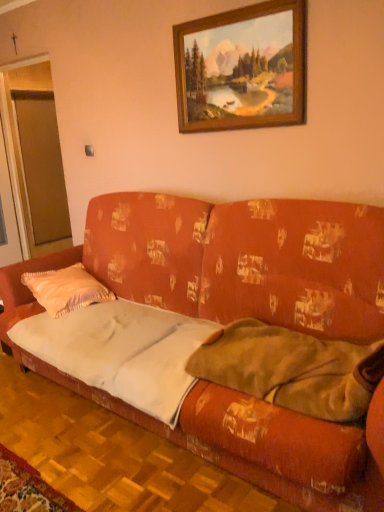
Locate an element on the screen. soft green blanket at right is located at coordinates (292, 369).

Find the location of a particular element. This screenshot has height=512, width=384. satin peach pillow at left is located at coordinates (66, 289).

The width and height of the screenshot is (384, 512). What do you see at coordinates (239, 318) in the screenshot? I see `velvet orange couch at center` at bounding box center [239, 318].

Locate an element on the screen. The width and height of the screenshot is (384, 512). transparent glass door at left is located at coordinates (41, 167).

Is soft green blanket at right aimed at velvet orange couch at center?

Yes, soft green blanket at right is turned towards velvet orange couch at center.

Considering the relative sizes of soft green blanket at right and velvet orange couch at center in the image provided, is soft green blanket at right taller than velvet orange couch at center?

In fact, soft green blanket at right may be shorter than velvet orange couch at center.

From the image's perspective, is soft green blanket at right below velvet orange couch at center?

Yes, from the image's perspective, soft green blanket at right is below velvet orange couch at center.

Considering the positions of points (339, 408) and (231, 458), is point (339, 408) closer to camera compared to point (231, 458)?

Yes, it is in front of point (231, 458).

Is white fabric sheet at center thinner than wooden picture frame at upper center?

No, white fabric sheet at center is not thinner than wooden picture frame at upper center.

Between white fabric sheet at center and wooden picture frame at upper center, which one has more height?

Standing taller between the two is wooden picture frame at upper center.

Is white fabric sheet at center not within wooden picture frame at upper center?

white fabric sheet at center lies outside wooden picture frame at upper center's area.

Between transparent glass door at left and wooden picture frame at upper center, which one appears on the left side from the viewer's perspective?

Answer: transparent glass door at left.

Can you confirm if transparent glass door at left is wider than wooden picture frame at upper center?

Indeed, transparent glass door at left has a greater width compared to wooden picture frame at upper center.

Is transparent glass door at left located outside wooden picture frame at upper center?

Yes, transparent glass door at left is outside of wooden picture frame at upper center.

Is transparent glass door at left positioned with its back to wooden picture frame at upper center?

transparent glass door at left is not turned away from wooden picture frame at upper center.

Based on the photo, considering the positions of objects white fabric sheet at center and transparent glass door at left in the image provided, who is more to the right, white fabric sheet at center or transparent glass door at left?

white fabric sheet at center.

From the image's perspective, is white fabric sheet at center beneath transparent glass door at left?

Correct, white fabric sheet at center appears lower than transparent glass door at left in the image.

Between point (87, 329) and point (43, 147), which one is positioned in front?

The point (87, 329) is closer.

What's the angular difference between velvet orange couch at center and white fabric sheet at center's facing directions?

The angular difference between velvet orange couch at center and white fabric sheet at center is 1.5 degrees.

Is velvet orange couch at center far from white fabric sheet at center?

velvet orange couch at center is actually quite close to white fabric sheet at center.

You are a GUI agent. You are given a task and a screenshot of the screen. Output one action in this format:
    pyautogui.click(x=<x>, y=<y>)
    Task: Click on the studio couch that appears above the white fabric sheet at center (from the image's perspective)
    This screenshot has height=512, width=384.
    Given the screenshot: What is the action you would take?
    pyautogui.click(x=239, y=318)

Which object is further away from the camera, velvet orange couch at center or white fabric sheet at center?

white fabric sheet at center is further away from the camera.

From the image's perspective, is wooden picture frame at upper center above velvet orange couch at center?

Yes.

In order to click on picture frame located above the velvet orange couch at center (from a real-world perspective) in this screenshot , I will do `click(241, 68)`.

Considering the relative sizes of wooden picture frame at upper center and velvet orange couch at center in the image provided, is wooden picture frame at upper center bigger than velvet orange couch at center?

Incorrect, wooden picture frame at upper center is not larger than velvet orange couch at center.

Based on their positions, is wooden picture frame at upper center located to the left or right of velvet orange couch at center?

In the image, wooden picture frame at upper center appears on the right side of velvet orange couch at center.

Is the position of transparent glass door at left less distant than that of soft green blanket at right?

No.

From a real-world perspective, is transparent glass door at left on soft green blanket at right?

Correct, in the physical world, transparent glass door at left is higher than soft green blanket at right.

Between transparent glass door at left and soft green blanket at right, which one has smaller width?

transparent glass door at left is thinner.

Which is in front, point (53, 187) or point (343, 377)?

The point (343, 377) is in front.

You are a GUI agent. You are given a task and a screenshot of the screen. Output one action in this format:
    pyautogui.click(x=<x>, y=<y>)
    Task: Click on the blanket above the velvet orange couch at center (from a real-world perspective)
    This screenshot has height=512, width=384.
    Given the screenshot: What is the action you would take?
    pyautogui.click(x=292, y=369)

Image resolution: width=384 pixels, height=512 pixels. I want to click on picture frame to the right of white fabric sheet at center, so point(241,68).

Considering their positions, is wooden picture frame at upper center positioned closer to velvet orange couch at center than satin peach pillow at left?

The object closer to velvet orange couch at center is satin peach pillow at left.

Considering their positions, is transparent glass door at left positioned further to soft green blanket at right than satin peach pillow at left?

transparent glass door at left lies further to soft green blanket at right than the other object.

Looking at the image, which one is located further to white fabric sheet at center, transparent glass door at left or satin peach pillow at left?

transparent glass door at left is positioned further to the anchor white fabric sheet at center.

When comparing their distances from white fabric sheet at center, does wooden picture frame at upper center or velvet orange couch at center seem further?

wooden picture frame at upper center is positioned further to the anchor white fabric sheet at center.

From the picture: From the image, which object appears to be farther from white fabric sheet at center, transparent glass door at left or wooden picture frame at upper center?

Based on the image, transparent glass door at left appears to be further to white fabric sheet at center.

Estimate the real-world distances between objects in this image. Which object is further from white fabric sheet at center, velvet orange couch at center or soft green blanket at right?

Based on the image, soft green blanket at right appears to be further to white fabric sheet at center.

Looking at the image, which one is located closer to soft green blanket at right, wooden picture frame at upper center or satin peach pillow at left?

Among the two, satin peach pillow at left is located nearer to soft green blanket at right.

Which object lies nearer to the anchor point transparent glass door at left, satin peach pillow at left or wooden picture frame at upper center?

The object closer to transparent glass door at left is satin peach pillow at left.

The height and width of the screenshot is (512, 384). In order to click on blanket between wooden picture frame at upper center and white fabric sheet at center vertically in this screenshot , I will do `click(292, 369)`.

Where is `sheet between satin peach pillow at left and soft green blanket at right from left to right`? The height and width of the screenshot is (512, 384). sheet between satin peach pillow at left and soft green blanket at right from left to right is located at coordinates (121, 351).

Find the location of a particular element. This screenshot has height=512, width=384. sheet between velvet orange couch at center and transparent glass door at left along the z-axis is located at coordinates (121, 351).

The width and height of the screenshot is (384, 512). What are the coordinates of `picture frame positioned between soft green blanket at right and transparent glass door at left from near to far` in the screenshot? It's located at (241, 68).